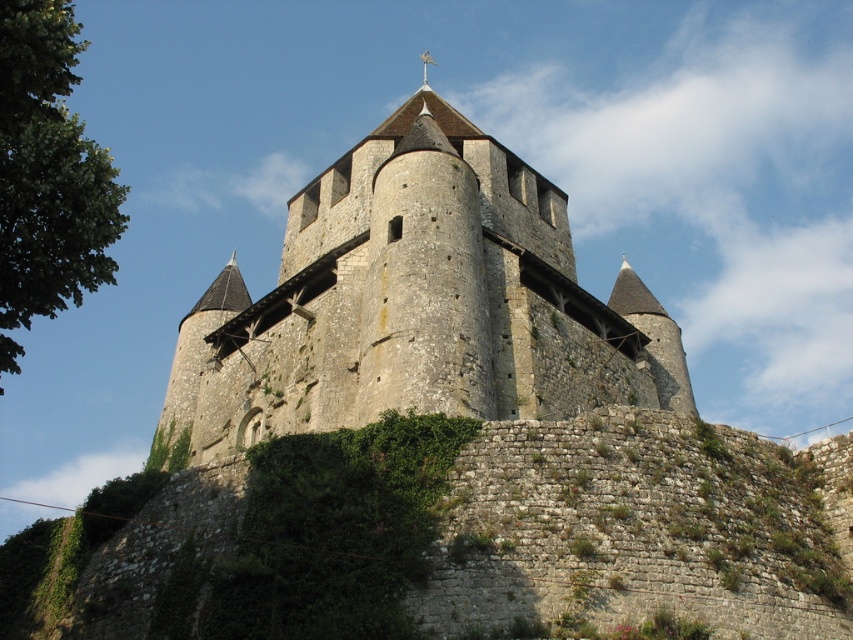
Question: Which object appears closest to the camera in this image?

Choices:
 (A) green mossy stone wall at center
 (B) stone castle at center

Answer: (A)

Question: Is the position of green mossy stone wall at center less distant than that of stone castle at center?

Choices:
 (A) no
 (B) yes

Answer: (B)

Question: Observing the image, what is the correct spatial positioning of green mossy stone wall at center in reference to stone castle at center?

Choices:
 (A) above
 (B) below

Answer: (B)

Question: Which object is closer to the camera taking this photo?

Choices:
 (A) green mossy stone wall at center
 (B) stone castle at center

Answer: (A)

Question: Is green mossy stone wall at center above stone castle at center?

Choices:
 (A) yes
 (B) no

Answer: (B)